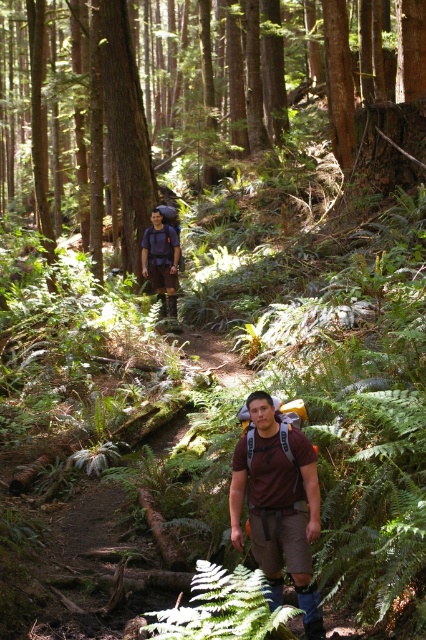
Does smooth brown tree trunk at upper center appear on the right side of green leafy fern at center?

Incorrect, smooth brown tree trunk at upper center is not on the right side of green leafy fern at center.

Does smooth brown tree trunk at upper center appear over green leafy fern at center?

Indeed, smooth brown tree trunk at upper center is positioned over green leafy fern at center.

Where is `smooth brown tree trunk at upper center`? smooth brown tree trunk at upper center is located at coordinates (126, 129).

Is point (261, 420) farther from camera compared to point (118, 140)?

That is False.

Locate an element on the screen. brown fabric backpack at center is located at coordinates (279, 504).

Is brown wood tree at upper center taller than brown fabric backpack at center?

Yes.

Which is behind, point (207, 51) or point (236, 532)?

Positioned behind is point (207, 51).

Where is `brown wood tree at upper center`? brown wood tree at upper center is located at coordinates [236, 83].